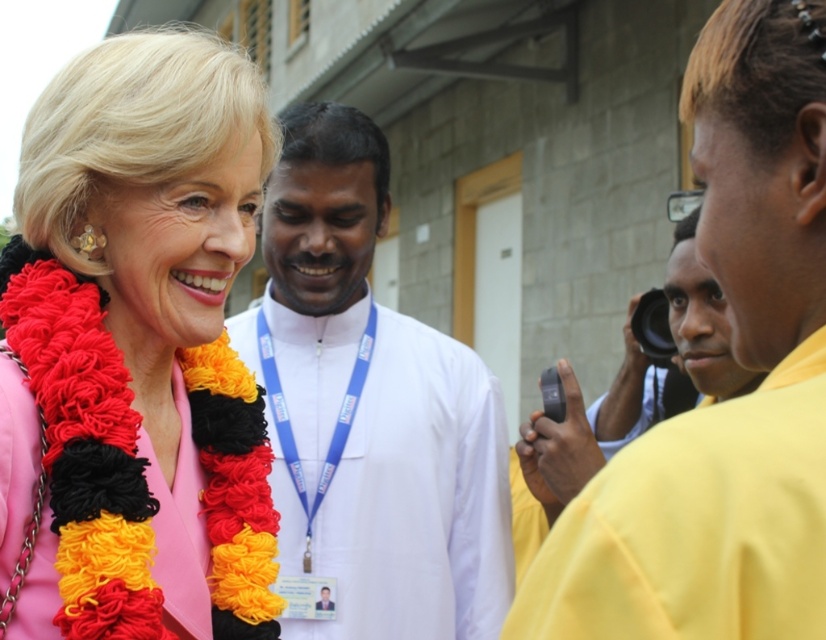
Is pink fabric scarf at upper left to the right of white cloth at center from the viewer's perspective?

No, pink fabric scarf at upper left is not to the right of white cloth at center.

Measure the distance between point (103, 355) and camera.

The distance of point (103, 355) from camera is 2.98 meters.

This screenshot has height=640, width=826. In order to click on pink fabric scarf at upper left in this screenshot , I will do `click(135, 349)`.

Looking at this image, which is more to the left, pink fabric scarf at upper left or yellow fabric at right?

From the viewer's perspective, pink fabric scarf at upper left appears more on the left side.

Is pink fabric scarf at upper left above yellow fabric at right?

Yes, pink fabric scarf at upper left is above yellow fabric at right.

Between point (136, 298) and point (696, 630), which one is positioned in front?

Point (696, 630) is in front.

Locate an element on the screen. The width and height of the screenshot is (826, 640). pink fabric scarf at upper left is located at coordinates (135, 349).

Can you confirm if yellow fabric at right is shorter than white cloth at center?

Correct, yellow fabric at right is not as tall as white cloth at center.

Can you confirm if yellow fabric at right is smaller than white cloth at center?

Indeed, yellow fabric at right has a smaller size compared to white cloth at center.

What are the coordinates of `yellow fabric at right` in the screenshot? It's located at (730, 401).

Locate an element on the screen. This screenshot has width=826, height=640. yellow fabric at right is located at coordinates (730, 401).